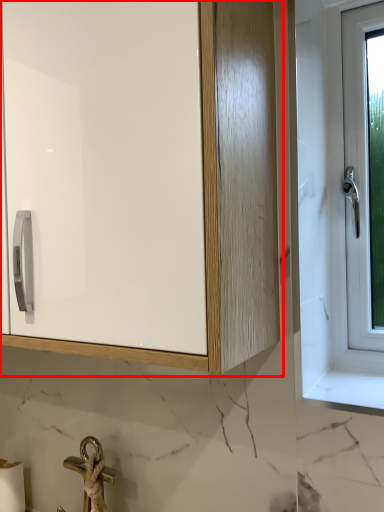
Question: From the image's perspective, what is the correct spatial relationship of cabinetry (annotated by the red box) in relation to toilet paper?

Choices:
 (A) below
 (B) above

Answer: (B)